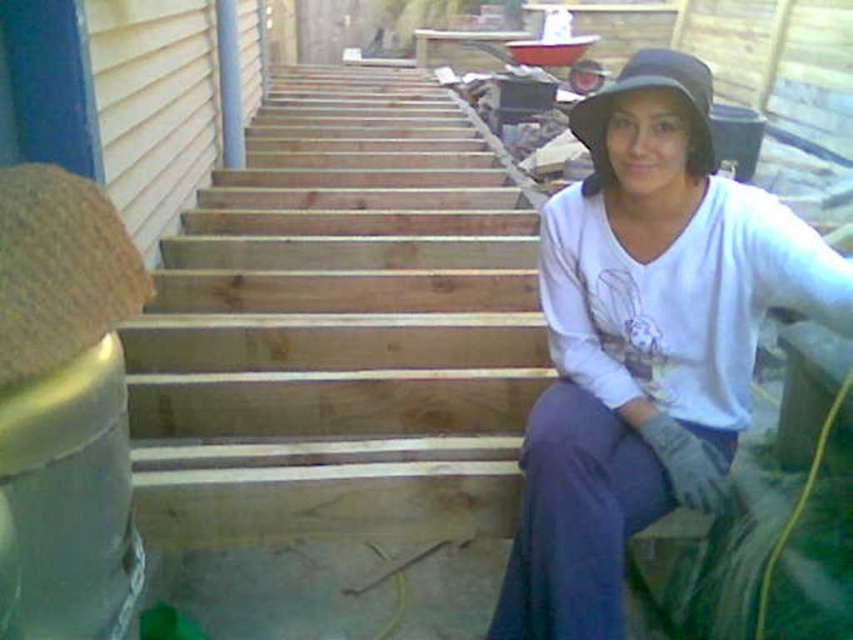
Is white matte shirt at center below black fabric hat at upper right?

Yes, white matte shirt at center is below black fabric hat at upper right.

What do you see at coordinates (643, 336) in the screenshot?
I see `white matte shirt at center` at bounding box center [643, 336].

Locate an element on the screen. white matte shirt at center is located at coordinates (643, 336).

Is natural wood stairs at center shorter than black fabric hat at upper right?

In fact, natural wood stairs at center may be taller than black fabric hat at upper right.

How distant is natural wood stairs at center from black fabric hat at upper right?

1.52 meters

Who is more distant from viewer, [192,381] or [596,154]?

Point [192,381]

Image resolution: width=853 pixels, height=640 pixels. What are the coordinates of `natural wood stairs at center` in the screenshot? It's located at (341, 326).

Does natural wood stairs at center appear under white matte shirt at center?

No, natural wood stairs at center is not below white matte shirt at center.

Which is in front, point (448, 435) or point (641, 145)?

Positioned in front is point (641, 145).

What do you see at coordinates (341, 326) in the screenshot? I see `natural wood stairs at center` at bounding box center [341, 326].

Locate an element on the screen. This screenshot has height=640, width=853. natural wood stairs at center is located at coordinates (341, 326).